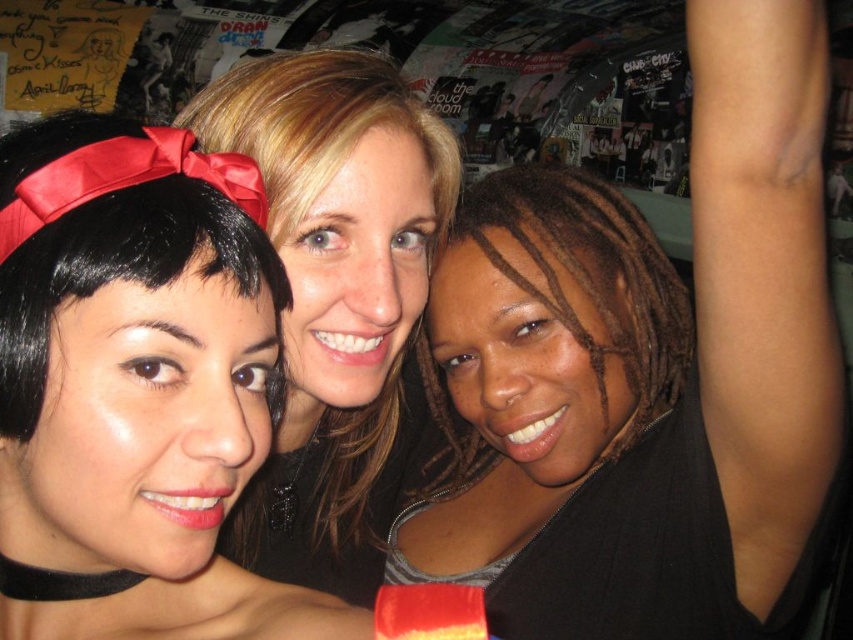
You are a photographer adjusting the camera settings. You notice two people in the frame with black matte hair at upper center and black hair at center. Which of these two has a hairstyle that is shorter in height?

The black matte hair at upper center has a lesser height compared to the black hair at center, so the black matte hair at upper center is shorter in height.

You are standing at the point with coordinates point (195, 188) and want to move towards the point with coordinates point (764, 100). Will you be moving forward or backward relative to your current position?

Since point (764, 100) is behind point (195, 188), moving towards it would mean moving backward relative to your current position at point (195, 188).